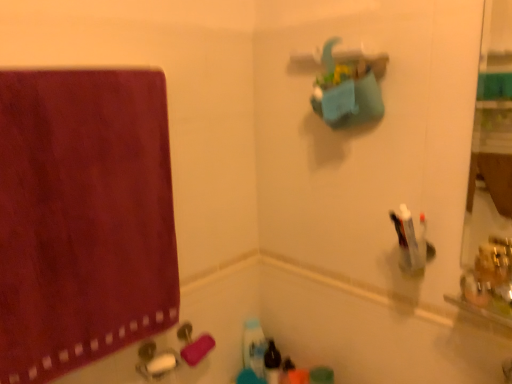
Locate an element on the screen. This screenshot has width=512, height=384. maroon fabric towel at left is located at coordinates (83, 218).

Describe the element at coordinates (83, 218) in the screenshot. I see `maroon fabric towel at left` at that location.

I want to click on maroon fabric towel at left, so click(83, 218).